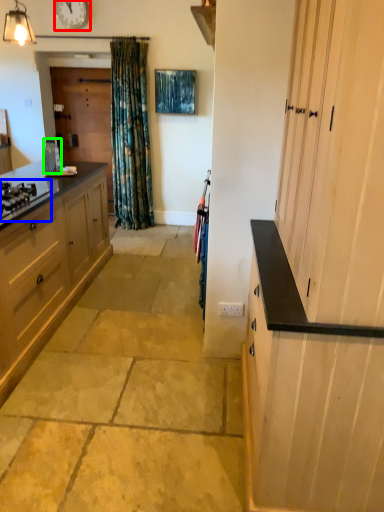
Question: Based on their relative distances, which object is farther from clock (highlighted by a red box)? Choose from gas stove (highlighted by a blue box) and appliance (highlighted by a green box).

Choices:
 (A) gas stove
 (B) appliance

Answer: (A)